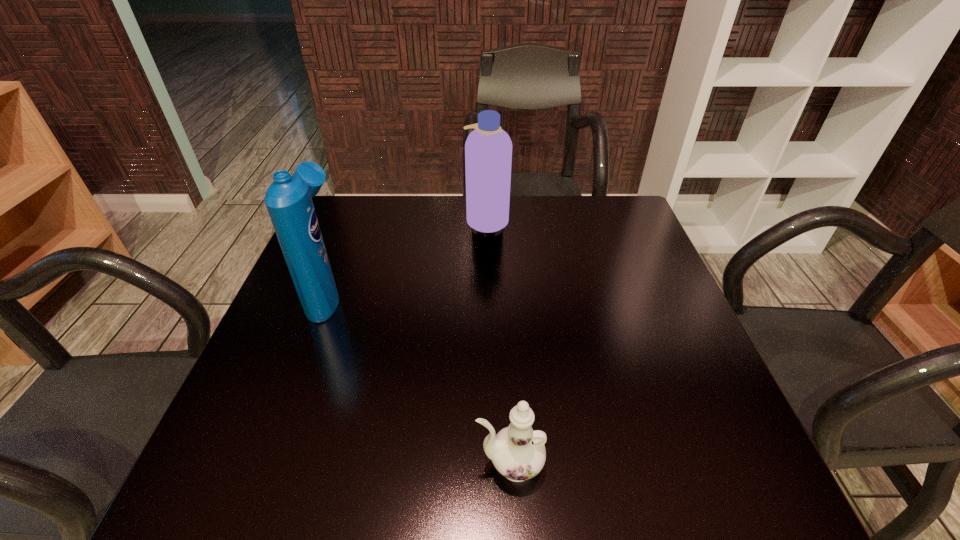
Find the location of a particular element. unoccupied area between the right shampoo and the shortest object is located at coordinates (498, 342).

The height and width of the screenshot is (540, 960). In order to click on vacant region between the nearest object and the second nearest object in this screenshot , I will do `click(419, 380)`.

Where is `blank region between the chinaware and the farther shampoo`? blank region between the chinaware and the farther shampoo is located at coordinates (498, 342).

Locate an element on the screen. This screenshot has width=960, height=540. free space that is in between the nearer shampoo and the right shampoo is located at coordinates (407, 257).

Find the location of `vacant region between the right shampoo and the nearer shampoo`. vacant region between the right shampoo and the nearer shampoo is located at coordinates (407, 257).

Locate an element on the screen. vacant area that lies between the left shampoo and the farthest object is located at coordinates (407, 257).

Find the location of a particular element. vacant area between the left shampoo and the shortest object is located at coordinates (419, 380).

Image resolution: width=960 pixels, height=540 pixels. I want to click on free space between the farthest object and the leftmost object, so click(407, 257).

Find the location of `vacant area that lies between the farthest object and the shortest object`. vacant area that lies between the farthest object and the shortest object is located at coordinates point(498,342).

What are the coordinates of `object that stands as the second closest to the farther shampoo` in the screenshot? It's located at (518, 452).